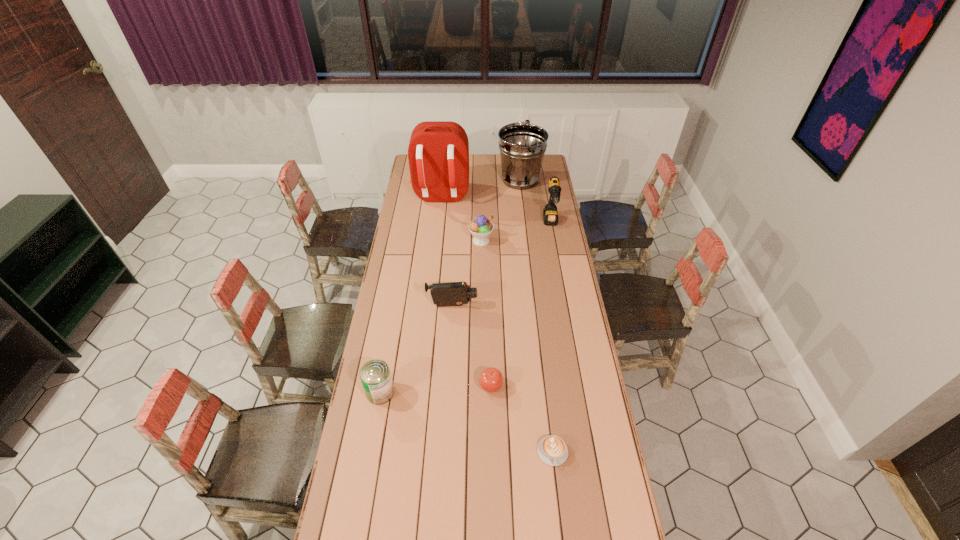
You are a GUI agent. You are given a task and a screenshot of the screen. Output one action in this format:
    pyautogui.click(x=<x>, y=<y>)
    Task: Click on the bucket at the right edge
    Image resolution: width=960 pixels, height=540 pixels.
    Given the screenshot: What is the action you would take?
    pyautogui.click(x=522, y=146)

I want to click on drill at the right edge, so click(550, 214).

This screenshot has height=540, width=960. In order to click on cappuccino situated at the right edge in this screenshot , I will do `click(552, 450)`.

The height and width of the screenshot is (540, 960). Find the location of `object situated at the far right corner`. object situated at the far right corner is located at coordinates (522, 146).

The height and width of the screenshot is (540, 960). In the image, there is a desktop. What are the coordinates of `free space at the far edge` in the screenshot? It's located at (489, 163).

The width and height of the screenshot is (960, 540). I want to click on vacant space at the left edge, so click(x=344, y=489).

At what (x,y) coordinates should I click in order to perform the action: click on vacant space at the right edge of the desktop. Please return your answer as a coordinate pair (x, y). The width and height of the screenshot is (960, 540). Looking at the image, I should click on (564, 341).

Where is `empty space that is in between the bucket and the second shortest object`? The width and height of the screenshot is (960, 540). empty space that is in between the bucket and the second shortest object is located at coordinates (x=505, y=283).

The height and width of the screenshot is (540, 960). Find the location of `free space that is in between the drill and the icecream`. free space that is in between the drill and the icecream is located at coordinates (516, 232).

In order to click on vacant space that is in between the camcorder and the backpack in this screenshot , I will do `click(446, 251)`.